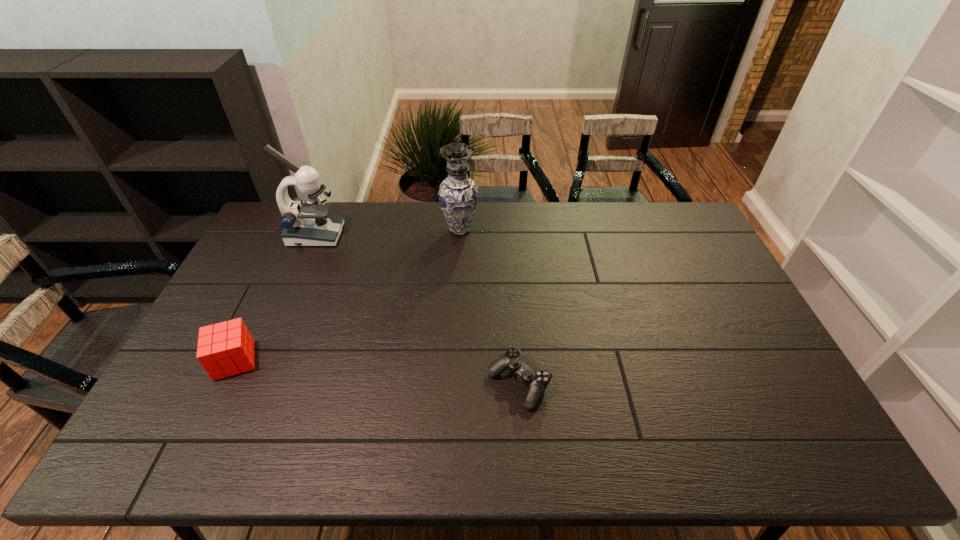
This screenshot has width=960, height=540. Identify the location of vase that is at the far edge. (458, 194).

Locate an element on the screen. microscope present at the left edge is located at coordinates click(x=305, y=223).

Where is `cube that is positioned at the left edge`? cube that is positioned at the left edge is located at coordinates (227, 348).

Identify the location of object that is at the far left corner. This screenshot has width=960, height=540. (305, 223).

The width and height of the screenshot is (960, 540). In the image, there is a desktop. Identify the location of vacant space at the far edge. (429, 230).

You are a GUI agent. You are given a task and a screenshot of the screen. Output one action in this format:
    pyautogui.click(x=<x>, y=<y>)
    Task: Click on the free spot at the near edge of the desktop
    
    Given the screenshot: What is the action you would take?
    pyautogui.click(x=628, y=434)

I want to click on vacant space at the right edge of the desktop, so click(744, 333).

Locate an element on the screen. This screenshot has height=540, width=960. free region at the near right corner of the desktop is located at coordinates (758, 453).

Where is `free space between the third tallest object and the microscope`? The height and width of the screenshot is (540, 960). free space between the third tallest object and the microscope is located at coordinates (275, 298).

This screenshot has height=540, width=960. Identify the location of free point between the vase and the cube. (348, 295).